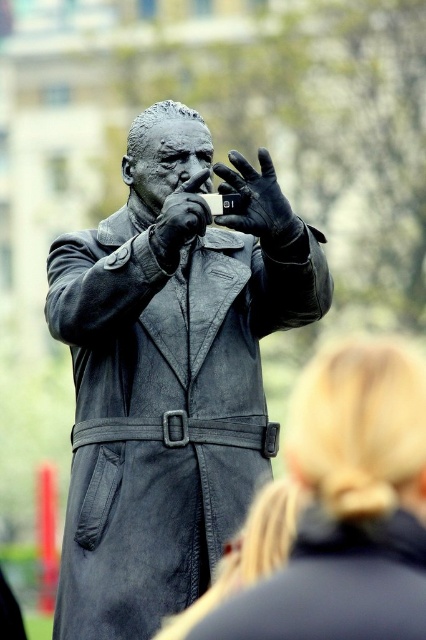
Consider the image. You are standing at the point with coordinates closest to the statue in the image. You want to walk towards the point labeled as point (259, 225). Will you pass by the point labeled point (137, 262) along the way?

Yes, you will pass by point (137, 262) because it is in front of point (259, 225), so the path to point (259, 225) would go through point (137, 262) first.

Based on the photo, you are a sculptor examining the statue and notice the black leather glove at center and the polished bronze hand at center. Which object is closer to you?

The black leather glove at center is closer to you because it is in front of the polished bronze hand at center.